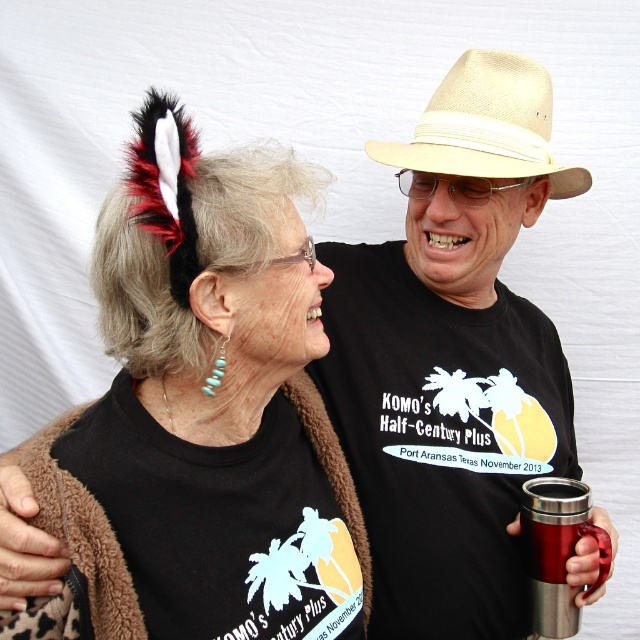
Question: Which point is farther to the camera?

Choices:
 (A) (518, 100)
 (B) (225, 401)

Answer: (A)

Question: In this image, where is beige straw hat at upper center located relative to stainless steel cup at right?

Choices:
 (A) below
 (B) above

Answer: (B)

Question: Which point appears closest to the camera in this image?

Choices:
 (A) (291, 390)
 (B) (536, 605)

Answer: (A)

Question: Can you confirm if black feather headband at upper left is positioned to the left of stainless steel cup at right?

Choices:
 (A) no
 (B) yes

Answer: (B)

Question: Among these points, which one is farthest from the camera?

Choices:
 (A) (52, 520)
 (B) (435, 97)
 (C) (552, 499)

Answer: (B)

Question: In this image, where is black feather headband at upper left located relative to stainless steel cup at right?

Choices:
 (A) above
 (B) below

Answer: (A)